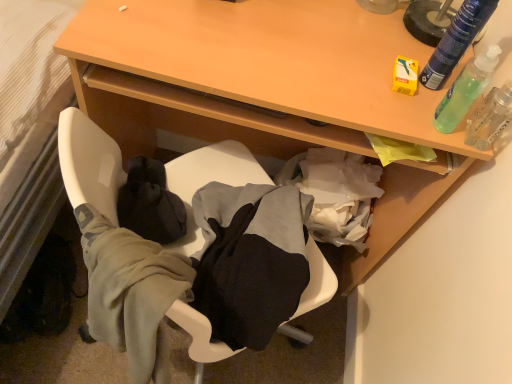
Where is `vacant space behind clear plastic spray bottle at upper right`? vacant space behind clear plastic spray bottle at upper right is located at coordinates (453, 89).